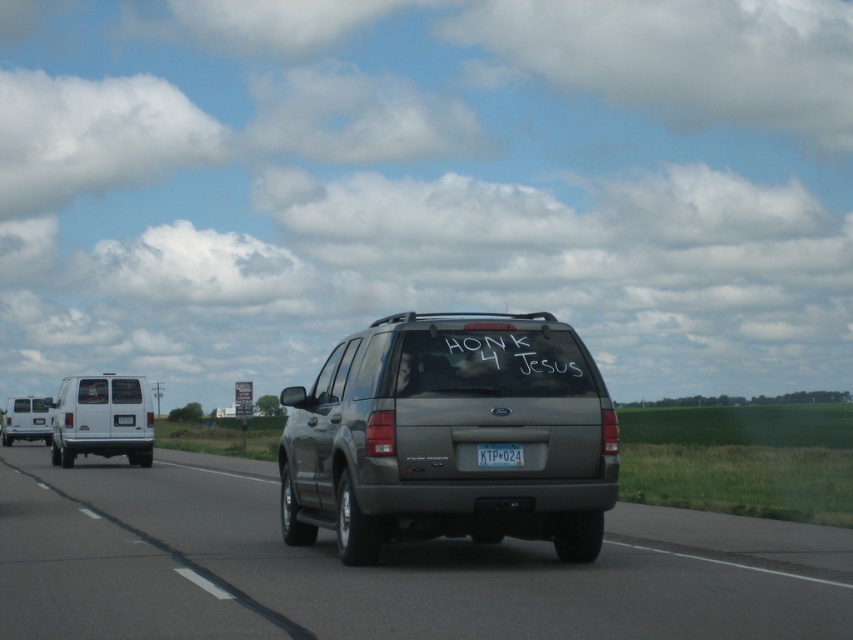
You are a traffic officer observing the highway scene. You notice the white matte van at left and the white plastic license plate at center. Which object is closer to the viewer?

The white matte van at left is closer to the viewer because the white plastic license plate at center is behind it.

You are a traffic officer analyzing the scene. The highway has three lanes. The center lane is for passing. The satin gray suv at center is in which lane?

The satin gray suv at center is in the center lane because it is positioned at point (375,570), which corresponds to the center lane on the highway.

Looking at this image, you are a traffic officer observing the scene from a helicopter above the highway. You notice the satin gray suv at center and the white plastic license plate at center. Which object is positioned closer to your viewpoint?

The satin gray suv at center is closer to the viewer than the white plastic license plate at center, so the satin gray suv at center is positioned closer to your viewpoint.